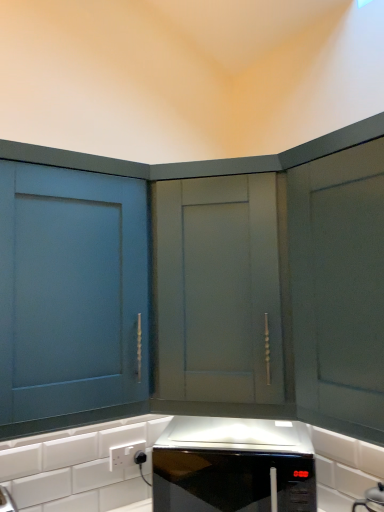
Question: Is the depth of matte blue cabinet at left, which is counted as the 2th cabinetry, starting from the right, greater than that of black glossy microwave at center?

Choices:
 (A) yes
 (B) no

Answer: (B)

Question: Is matte blue cabinet at left, which ranks as the first cabinetry in left-to-right order, in front of black glossy microwave at center?

Choices:
 (A) yes
 (B) no

Answer: (A)

Question: From the image's perspective, would you say matte blue cabinet at left, which is counted as the 2th cabinetry, starting from the right, is shown under black glossy microwave at center?

Choices:
 (A) yes
 (B) no

Answer: (B)

Question: Can you confirm if matte blue cabinet at left, which ranks as the first cabinetry in left-to-right order, is taller than black glossy microwave at center?

Choices:
 (A) yes
 (B) no

Answer: (A)

Question: Is matte blue cabinet at left, which ranks as the first cabinetry in left-to-right order, to the left of black glossy microwave at center from the viewer's perspective?

Choices:
 (A) no
 (B) yes

Answer: (B)

Question: Is matte gray cabinet at center, which appears as the 1th cabinetry when viewed from the right, wider or thinner than black glossy microwave at center?

Choices:
 (A) thin
 (B) wide

Answer: (B)

Question: In terms of height, does matte gray cabinet at center, which appears as the 1th cabinetry when viewed from the right, look taller or shorter compared to black glossy microwave at center?

Choices:
 (A) short
 (B) tall

Answer: (B)

Question: From the image's perspective, is matte gray cabinet at center, which appears as the 1th cabinetry when viewed from the right, above or below black glossy microwave at center?

Choices:
 (A) below
 (B) above

Answer: (B)

Question: Does point (155, 177) appear closer or farther from the camera than point (228, 434)?

Choices:
 (A) farther
 (B) closer

Answer: (B)

Question: Considering the positions of matte blue cabinet at left, which is counted as the 2th cabinetry, starting from the right, and white plastic electric outlet at lower center in the image, is matte blue cabinet at left, which is counted as the 2th cabinetry, starting from the right, bigger or smaller than white plastic electric outlet at lower center?

Choices:
 (A) big
 (B) small

Answer: (A)

Question: From the image's perspective, relative to white plastic electric outlet at lower center, is matte blue cabinet at left, which is counted as the 2th cabinetry, starting from the right, above or below?

Choices:
 (A) below
 (B) above

Answer: (B)

Question: Would you say matte blue cabinet at left, which is counted as the 2th cabinetry, starting from the right, is inside or outside white plastic electric outlet at lower center?

Choices:
 (A) inside
 (B) outside

Answer: (B)

Question: Looking at their shapes, would you say matte blue cabinet at left, which is counted as the 2th cabinetry, starting from the right, is wider or thinner than white plastic electric outlet at lower center?

Choices:
 (A) wide
 (B) thin

Answer: (A)

Question: Is matte blue cabinet at left, which ranks as the first cabinetry in left-to-right order, spatially inside black glossy microwave at center, or outside of it?

Choices:
 (A) inside
 (B) outside

Answer: (B)

Question: Considering the positions of point (114, 327) and point (244, 442), is point (114, 327) closer or farther from the camera than point (244, 442)?

Choices:
 (A) closer
 (B) farther

Answer: (A)